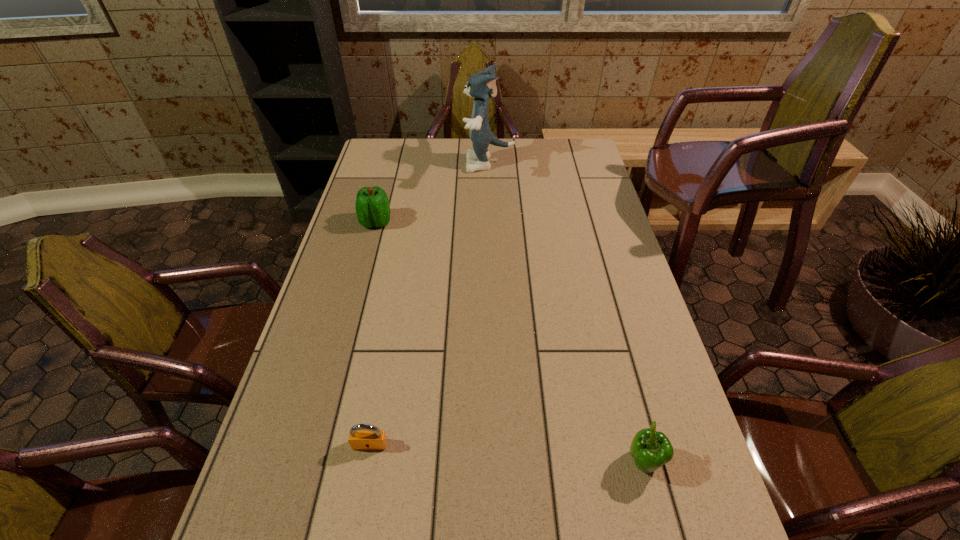
You are a GUI agent. You are given a task and a screenshot of the screen. Output one action in this format:
    pyautogui.click(x=<x>, y=<y>)
    Task: Click on the free space at the far left corner
    
    Given the screenshot: What is the action you would take?
    pyautogui.click(x=405, y=153)

At what (x,y) coordinates should I click in order to perform the action: click on vacant area at the far right corner. Please return your answer as a coordinate pair (x, y). The width and height of the screenshot is (960, 540). Looking at the image, I should click on (573, 147).

Locate an element on the screen. free spot between the left bell pepper and the farthest object is located at coordinates (434, 193).

Identify the location of unoccupied area between the third object from right to left and the left bell pepper. The width and height of the screenshot is (960, 540). (372, 333).

What are the coordinates of `free space between the rightmost object and the leftmost object` in the screenshot? It's located at (510, 342).

The height and width of the screenshot is (540, 960). What are the coordinates of `empty location between the second farthest object and the right bell pepper` in the screenshot? It's located at (510, 342).

You are a GUI agent. You are given a task and a screenshot of the screen. Output one action in this format:
    pyautogui.click(x=<x>, y=<y>)
    Task: Click on the free space between the third object from left to right and the third object from right to left
    This screenshot has height=540, width=960.
    Given the screenshot: What is the action you would take?
    pyautogui.click(x=431, y=304)

The width and height of the screenshot is (960, 540). I want to click on vacant area that lies between the left bell pepper and the padlock, so click(372, 333).

Identify the location of vacant space in between the farther bell pepper and the right bell pepper. (510, 342).

At what (x,y) coordinates should I click in order to perform the action: click on free area in between the rightmost object and the padlock. Please return your answer as a coordinate pair (x, y). Looking at the image, I should click on (507, 454).